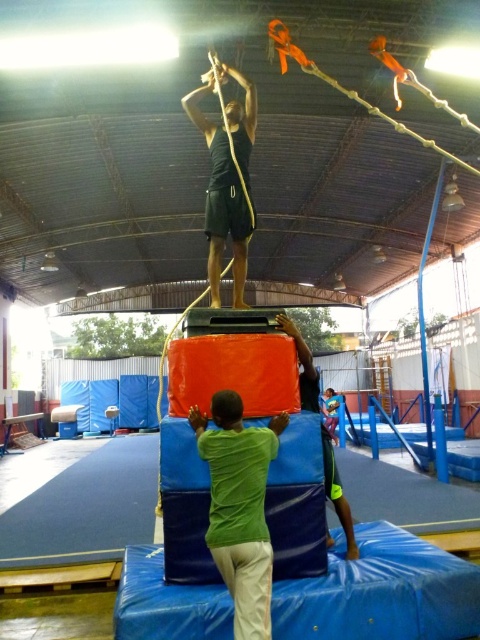
Which is more to the left, green matte shirt at center or green fabric person at center?

green matte shirt at center

Measure the distance between green matte shirt at center and camera.

green matte shirt at center and camera are 2.34 meters apart from each other.

Is point (264, 531) in front of point (324, 477)?

Yes, it is in front of point (324, 477).

I want to click on green matte shirt at center, so click(x=240, y=508).

Can you confirm if matte black tank top at center is shorter than green fabric person at center?

Incorrect, matte black tank top at center's height does not fall short of green fabric person at center's.

Between matte black tank top at center and green fabric person at center, which one has more height?

Standing taller between the two is matte black tank top at center.

Identify the location of matte black tank top at center. (227, 179).

Can you confirm if green matte shirt at center is thinner than matte black tank top at center?

Indeed, green matte shirt at center has a lesser width compared to matte black tank top at center.

What do you see at coordinates (240, 508) in the screenshot?
I see `green matte shirt at center` at bounding box center [240, 508].

Locate an element on the screen. green matte shirt at center is located at coordinates (240, 508).